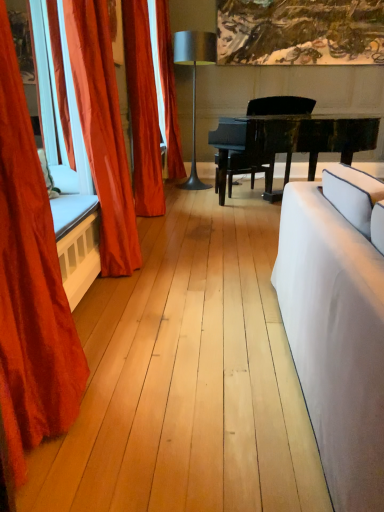
Question: From a real-world perspective, is metallic silver lamp at center located higher than black polished piano at center?

Choices:
 (A) yes
 (B) no

Answer: (A)

Question: Is metallic silver lamp at center oriented away from black polished piano at center?

Choices:
 (A) no
 (B) yes

Answer: (A)

Question: Can you confirm if metallic silver lamp at center is positioned to the right of black polished piano at center?

Choices:
 (A) yes
 (B) no

Answer: (B)

Question: From a real-world perspective, is metallic silver lamp at center positioned under black polished piano at center based on gravity?

Choices:
 (A) no
 (B) yes

Answer: (A)

Question: Is metallic silver lamp at center in front of black polished piano at center?

Choices:
 (A) no
 (B) yes

Answer: (A)

Question: Could you tell me if metallic silver lamp at center is facing black polished piano at center?

Choices:
 (A) yes
 (B) no

Answer: (B)

Question: From the image's perspective, is velvet red curtain at left, arranged as the 4th curtain when viewed from the back, under black polished piano at center?

Choices:
 (A) yes
 (B) no

Answer: (A)

Question: Is velvet red curtain at left, marked as the 1th curtain in a front-to-back arrangement, shorter than black polished piano at center?

Choices:
 (A) no
 (B) yes

Answer: (A)

Question: Are velvet red curtain at left, marked as the 1th curtain in a front-to-back arrangement, and black polished piano at center located far from each other?

Choices:
 (A) yes
 (B) no

Answer: (A)

Question: Is velvet red curtain at left, arranged as the 4th curtain when viewed from the back, to the left of black polished piano at center from the viewer's perspective?

Choices:
 (A) no
 (B) yes

Answer: (B)

Question: Does velvet red curtain at left, marked as the 1th curtain in a front-to-back arrangement, have a lesser width compared to black polished piano at center?

Choices:
 (A) yes
 (B) no

Answer: (A)

Question: Could you tell me if velvet red curtain at left, arranged as the 4th curtain when viewed from the back, is turned towards black polished piano at center?

Choices:
 (A) no
 (B) yes

Answer: (A)

Question: Is black polished piano at center closer to camera compared to satin orange curtain at left, which is the second curtain from back to front?

Choices:
 (A) no
 (B) yes

Answer: (B)